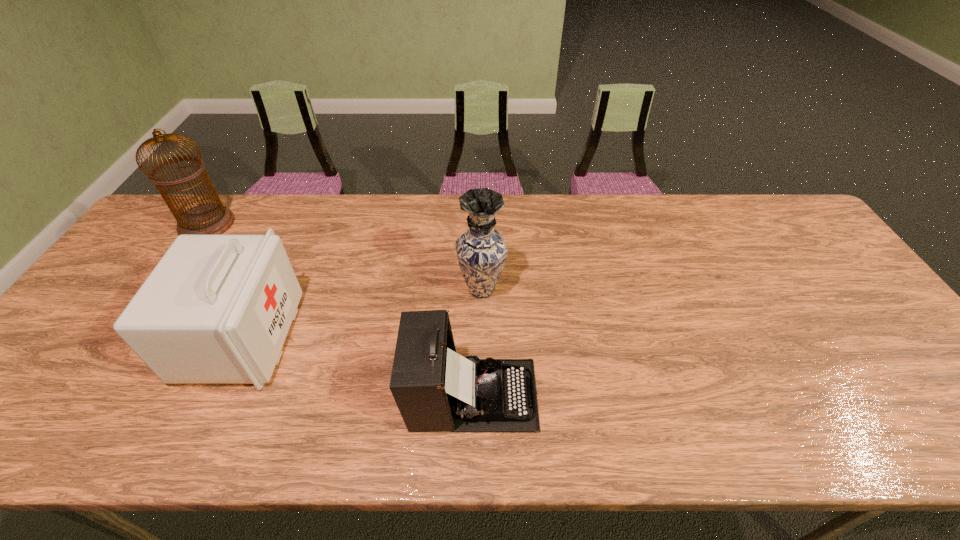
Identify the location of unoccupied area between the third object from right to left and the shortest object. (357, 366).

Where is `free spot between the third object from right to left and the shortest object`? The height and width of the screenshot is (540, 960). free spot between the third object from right to left and the shortest object is located at coordinates (357, 366).

In order to click on free space that is in between the leftmost object and the shortest object in this screenshot , I will do pos(339,309).

I want to click on object that is the second nearest to the vase, so click(216, 309).

Select which object is the closest to the birdcage. Please provide its 2D coordinates. Your answer should be formatted as a tuple, i.e. [(x, y)], where the tuple contains the x and y coordinates of a point satisfying the conditions above.

[(216, 309)]

At what (x,y) coordinates should I click in order to perform the action: click on free space that satisfies the following two spatial constraints: 1. on the front side of the vase; 2. inside the open case of the typewriter. Please return your answer as a coordinate pair (x, y). Looking at the image, I should click on (482, 395).

Image resolution: width=960 pixels, height=540 pixels. In order to click on free space that satisfies the following two spatial constraints: 1. on the front side of the vase; 2. on the front-facing side of the first-aid kit in this screenshot , I will do `click(481, 337)`.

Identify the location of vacant point that satisfies the following two spatial constraints: 1. on the front side of the vase; 2. inside the open case of the typewriter. The width and height of the screenshot is (960, 540). (482, 395).

At what (x,y) coordinates should I click in order to perform the action: click on free location that satisfies the following two spatial constraints: 1. on the front-facing side of the vase; 2. on the right side of the birdcage. Please return your answer as a coordinate pair (x, y). This screenshot has width=960, height=540. Looking at the image, I should click on (163, 289).

Locate an element on the screen. The height and width of the screenshot is (540, 960). vacant point that satisfies the following two spatial constraints: 1. on the front-facing side of the vase; 2. on the right side of the farthest object is located at coordinates (163, 289).